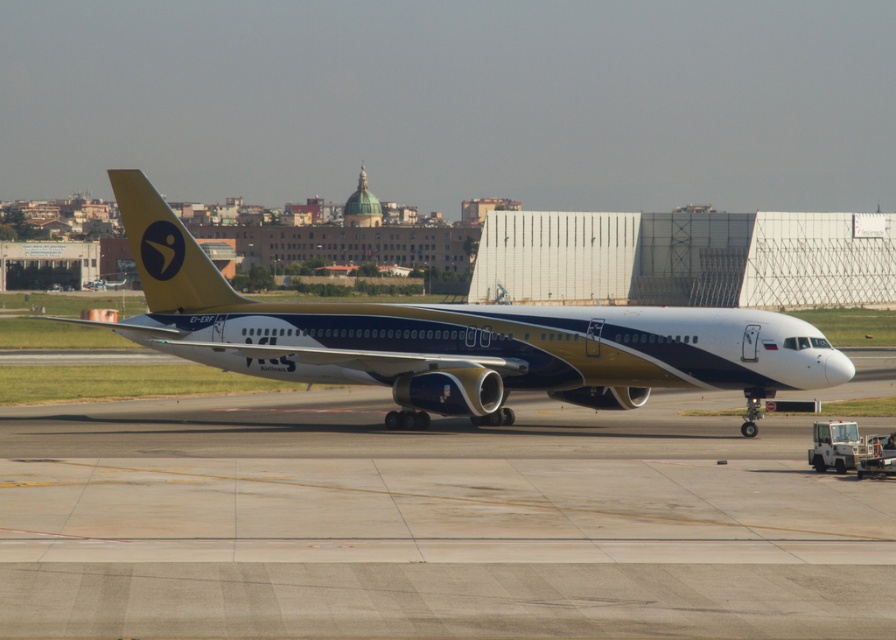
You are standing at the airport and see the commercial airplane. Where is the smooth concrete tarmac at center located in relation to the airplane?

The smooth concrete tarmac at center is located at point coordinates of approximately (429, 522).

From the picture: You are standing at the point marked as point (429, 522). What type of surface are you currently standing on?

You are standing on the smooth concrete tarmac at center.